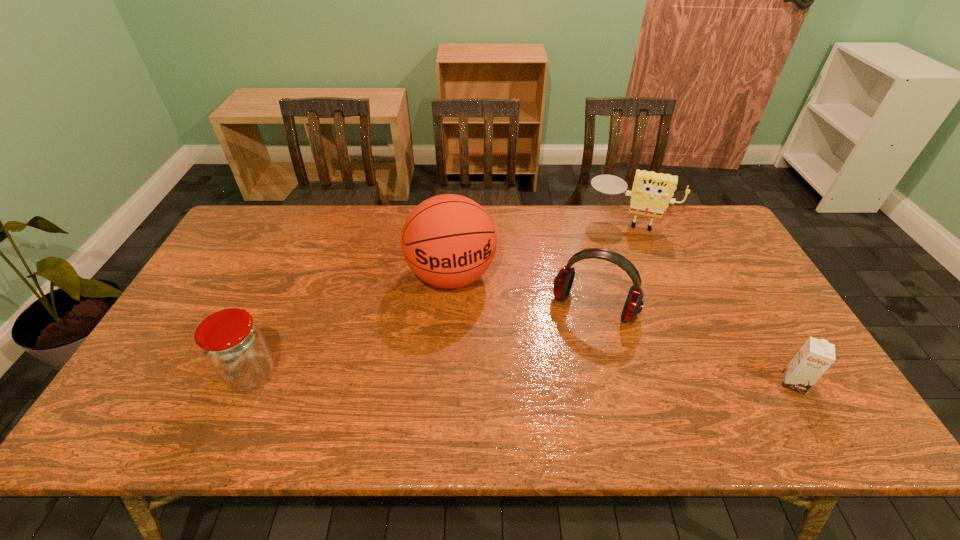
This screenshot has height=540, width=960. Find the location of `object identified as the second closest to the leftmost object`. object identified as the second closest to the leftmost object is located at coordinates (563, 281).

Identify the location of vacant space that satisfies the following two spatial constraints: 1. on the front side of the shortest object; 2. on the left side of the jar. Image resolution: width=960 pixels, height=540 pixels. (248, 383).

You are a GUI agent. You are given a task and a screenshot of the screen. Output one action in this format:
    pyautogui.click(x=<x>, y=<y>)
    Task: Click on the free space that satisfies the following two spatial constraints: 1. on the front side of the farthest object; 2. on the right side of the shortest object
    The width and height of the screenshot is (960, 540).
    Given the screenshot: What is the action you would take?
    pyautogui.click(x=692, y=383)